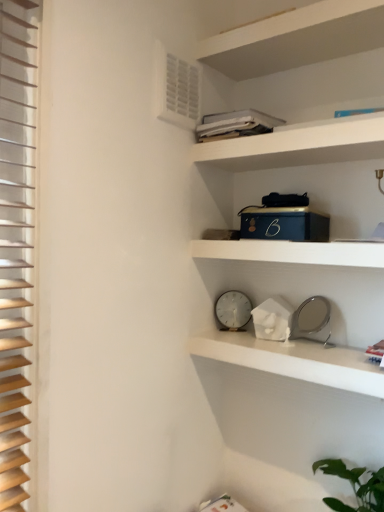
Measure the distance between white plastic clock at center and camera.

white plastic clock at center is 5.60 feet from camera.

Locate an element on the screen. white matte cabinet at upper center is located at coordinates (298, 145).

This screenshot has height=512, width=384. Describe the element at coordinates (292, 252) in the screenshot. I see `white matte clock at center, positioned as the first shelf in top-to-bottom order` at that location.

Image resolution: width=384 pixels, height=512 pixels. I want to click on white plastic air conditioning unit at upper left, so click(176, 88).

Is wooden blinds at left not near white marble clock at center, the second shelf in the top-to-bottom sequence?

Actually, wooden blinds at left and white marble clock at center, the second shelf in the top-to-bottom sequence, are a little close together.

Is wooden blinds at left looking in the opposite direction of white marble clock at center, the second shelf in the top-to-bottom sequence?

wooden blinds at left is not turned away from white marble clock at center, the second shelf in the top-to-bottom sequence.

In terms of height, does wooden blinds at left look taller or shorter compared to white marble clock at center, the second shelf in the top-to-bottom sequence?

In the image, wooden blinds at left appears to be taller than white marble clock at center, the second shelf in the top-to-bottom sequence.

Is wooden blinds at left wider or thinner than white marble clock at center, the first shelf when ordered from bottom to top?

Considering their sizes, wooden blinds at left looks slimmer than white marble clock at center, the first shelf when ordered from bottom to top.

Can you confirm if white plastic clock at center is positioned to the right of white matte cabinet at upper center?

In fact, white plastic clock at center is to the left of white matte cabinet at upper center.

From a real-world perspective, which is physically above, white plastic clock at center or white matte cabinet at upper center?

white matte cabinet at upper center is physically above.

In terms of height, does white plastic clock at center look taller or shorter compared to white matte cabinet at upper center?

Clearly, white plastic clock at center is taller compared to white matte cabinet at upper center.

Is white matte clock at center, which is the second shelf from bottom to top, in front of or behind white marble clock at center, the second shelf in the top-to-bottom sequence, in the image?

Clearly, white matte clock at center, which is the second shelf from bottom to top, is in front of white marble clock at center, the second shelf in the top-to-bottom sequence.

Considering the positions of points (269, 259) and (243, 365), is point (269, 259) closer to camera compared to point (243, 365)?

That is True.

From the picture: Would you say white matte clock at center, positioned as the first shelf in top-to-bottom order, is outside white marble clock at center, the first shelf when ordered from bottom to top?

Indeed, white matte clock at center, positioned as the first shelf in top-to-bottom order, is completely outside white marble clock at center, the first shelf when ordered from bottom to top.

From the image's perspective, is white matte clock at center, positioned as the first shelf in top-to-bottom order, above or below white marble clock at center, the second shelf in the top-to-bottom sequence?

Based on their image positions, white matte clock at center, positioned as the first shelf in top-to-bottom order, is located above white marble clock at center, the second shelf in the top-to-bottom sequence.

Is wooden blinds at left next to white plastic air conditioning unit at upper left and touching it?

No, wooden blinds at left is not next to white plastic air conditioning unit at upper left.

Based on the photo, how distant is wooden blinds at left from white plastic air conditioning unit at upper left?

wooden blinds at left and white plastic air conditioning unit at upper left are 60.55 centimeters apart from each other.

From the image's perspective, is wooden blinds at left above or below white plastic air conditioning unit at upper left?

Clearly, from the image's perspective, wooden blinds at left is below white plastic air conditioning unit at upper left.

From a real-world perspective, is wooden blinds at left positioned above or below white plastic air conditioning unit at upper left?

wooden blinds at left is below white plastic air conditioning unit at upper left.

Identify the location of shelf in front of the white marble clock at center, the first shelf when ordered from bottom to top. click(x=292, y=252).

In terms of size, does white marble clock at center, the first shelf when ordered from bottom to top, appear bigger or smaller than white matte clock at center, positioned as the first shelf in top-to-bottom order?

Considering their sizes, white marble clock at center, the first shelf when ordered from bottom to top, takes up more space than white matte clock at center, positioned as the first shelf in top-to-bottom order.

From a real-world perspective, is white marble clock at center, the first shelf when ordered from bottom to top, positioned above or below white matte clock at center, positioned as the first shelf in top-to-bottom order?

In terms of real-world spatial position, white marble clock at center, the first shelf when ordered from bottom to top, is below white matte clock at center, positioned as the first shelf in top-to-bottom order.

How different are the orientations of white marble clock at center, the first shelf when ordered from bottom to top, and white matte clock at center, positioned as the first shelf in top-to-bottom order, in degrees?

They differ by 1.39e-05 degrees in their facing directions.

Is white matte clock at center, positioned as the first shelf in top-to-bottom order, not inside white plastic clock at center?

white matte clock at center, positioned as the first shelf in top-to-bottom order, lies outside white plastic clock at center's area.

Considering the sizes of white matte clock at center, positioned as the first shelf in top-to-bottom order, and white plastic clock at center in the image, is white matte clock at center, positioned as the first shelf in top-to-bottom order, wider or thinner than white plastic clock at center?

In the image, white matte clock at center, positioned as the first shelf in top-to-bottom order, appears to be wider than white plastic clock at center.

Is point (277, 248) closer or farther from the camera than point (224, 296)?

Point (277, 248) appears to be closer to the viewer than point (224, 296).

From the image's perspective, which is below, white matte clock at center, positioned as the first shelf in top-to-bottom order, or white plastic clock at center?

white plastic clock at center, from the image's perspective.

Can you see white matte cabinet at upper center touching white plastic air conditioning unit at upper left?

No, white matte cabinet at upper center is not making contact with white plastic air conditioning unit at upper left.

Could you tell me if white matte cabinet at upper center is turned towards white plastic air conditioning unit at upper left?

No, white matte cabinet at upper center does not turn towards white plastic air conditioning unit at upper left.

How many degrees apart are the facing directions of white matte cabinet at upper center and white plastic air conditioning unit at upper left?

The facing directions of white matte cabinet at upper center and white plastic air conditioning unit at upper left are 89.5 degrees apart.

How distant is white matte cabinet at upper center from white plastic air conditioning unit at upper left?

12.26 inches.

Locate an element on the screen. This screenshot has height=512, width=384. shelf that is below the wooden blinds at left (from the image's perspective) is located at coordinates (292, 360).

Find the location of a particular element. This screenshot has height=512, width=384. cabinet in front of the white plastic clock at center is located at coordinates pos(298,145).

Estimate the real-world distances between objects in this image. Which object is closer to wooden blinds at left, white plastic air conditioning unit at upper left or white marble clock at center, the first shelf when ordered from bottom to top?

white plastic air conditioning unit at upper left.

Which object lies further to the anchor point white matte cabinet at upper center, white matte clock at center, which is the second shelf from bottom to top, or white plastic clock at center?

white plastic clock at center lies further to white matte cabinet at upper center than the other object.

Looking at the image, which one is located closer to white marble clock at center, the first shelf when ordered from bottom to top, wooden blinds at left or white matte cabinet at upper center?

Among the two, white matte cabinet at upper center is located nearer to white marble clock at center, the first shelf when ordered from bottom to top.

Looking at the image, which one is located further to white plastic clock at center, wooden blinds at left or white plastic air conditioning unit at upper left?

wooden blinds at left.

Considering their positions, is white plastic clock at center positioned further to white matte cabinet at upper center than white matte clock at center, which is the second shelf from bottom to top?

white plastic clock at center lies further to white matte cabinet at upper center than the other object.

Which object lies further to the anchor point white plastic clock at center, wooden blinds at left or white marble clock at center, the second shelf in the top-to-bottom sequence?

wooden blinds at left.

Based on their spatial positions, is white marble clock at center, the second shelf in the top-to-bottom sequence, or white matte clock at center, which is the second shelf from bottom to top, closer to wooden blinds at left?

Among the two, white matte clock at center, which is the second shelf from bottom to top, is located nearer to wooden blinds at left.

Which object lies further to the anchor point white matte cabinet at upper center, white plastic air conditioning unit at upper left or wooden blinds at left?

wooden blinds at left lies further to white matte cabinet at upper center than the other object.

Find the location of a particular element. cabinet between white plastic air conditioning unit at upper left and white plastic clock at center in the up-down direction is located at coordinates (298, 145).

Find the location of a particular element. This screenshot has height=512, width=384. clock that lies between white matte cabinet at upper center and white marble clock at center, the first shelf when ordered from bottom to top, from top to bottom is located at coordinates (233, 310).

I want to click on shelf situated between wooden blinds at left and white matte clock at center, which is the second shelf from bottom to top, from left to right, so point(292,360).

Where is `air conditioning situated between wooden blinds at left and white matte clock at center, which is the second shelf from bottom to top, from left to right`? Image resolution: width=384 pixels, height=512 pixels. air conditioning situated between wooden blinds at left and white matte clock at center, which is the second shelf from bottom to top, from left to right is located at coordinates (176, 88).